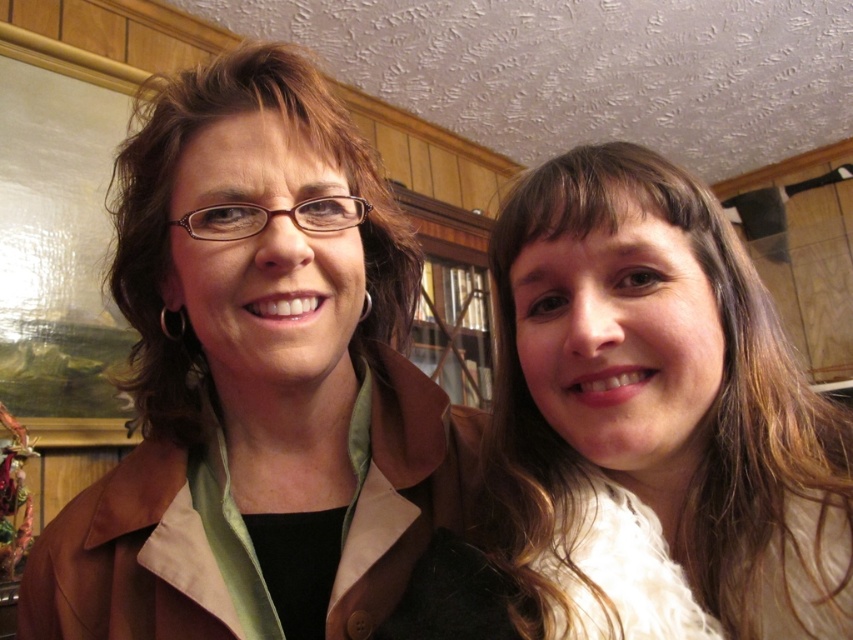
You are trying to locate the matte brown jacket at center in the image. According to the scene description, where exactly is it positioned?

The matte brown jacket at center is located at point 0.606 on the x axis and 0.307 on the y axis.

You are a photographer trying to capture the smooth white blouse at right and the brown matte hair at center in a single frame. Based on their positions, which object is closer to the bottom of the image?

The smooth white blouse at right is closer to the bottom of the image because it is positioned below the brown matte hair at center.

You are trying to locate the matte brown jacket at center in the image. According to the coordinates provided, where exactly is it positioned?

The matte brown jacket at center is positioned at the coordinates point (x=260, y=387).